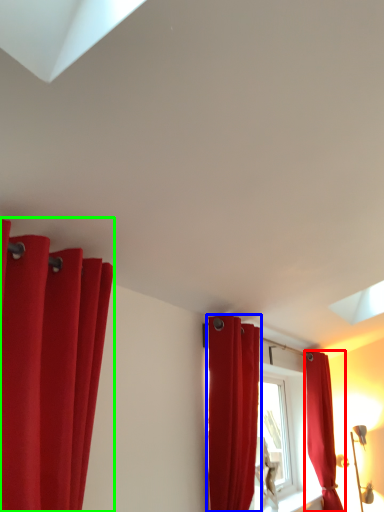
Question: Based on their relative distances, which object is farther from curtain (highlighted by a red box)? Choose from curtain (highlighted by a blue box) and curtain (highlighted by a green box).

Choices:
 (A) curtain
 (B) curtain

Answer: (B)